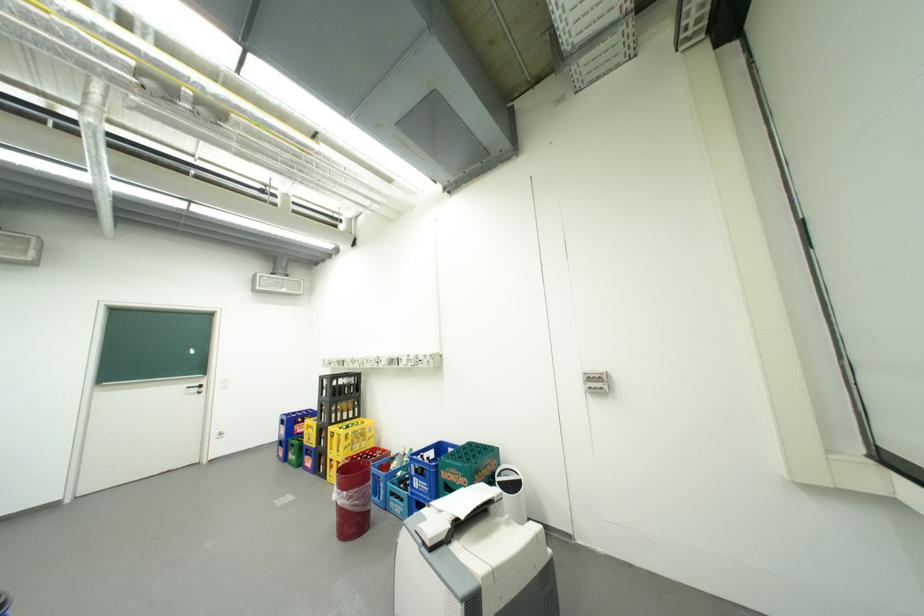
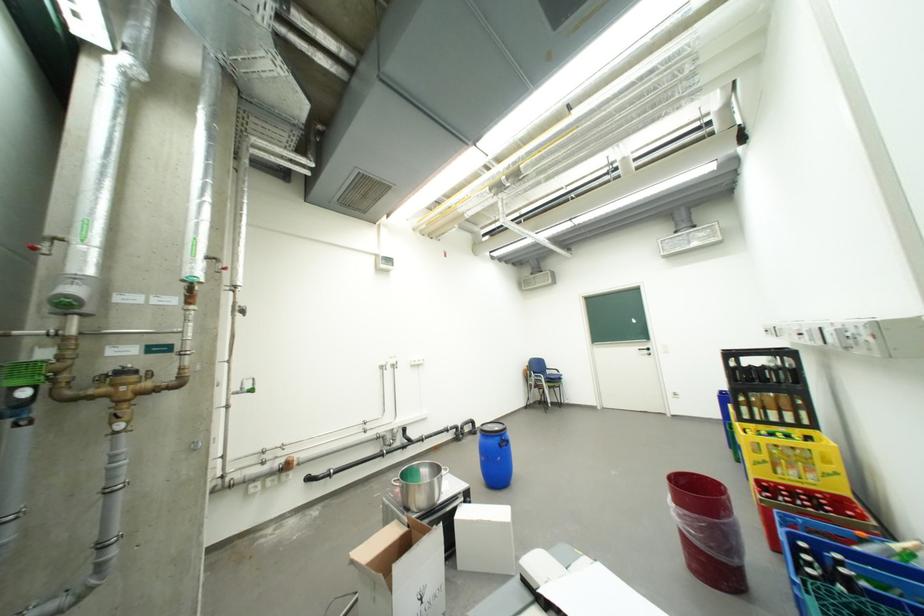
Find the pixel in the second image that matches pixel 371 451 in the first image.

(810, 484)